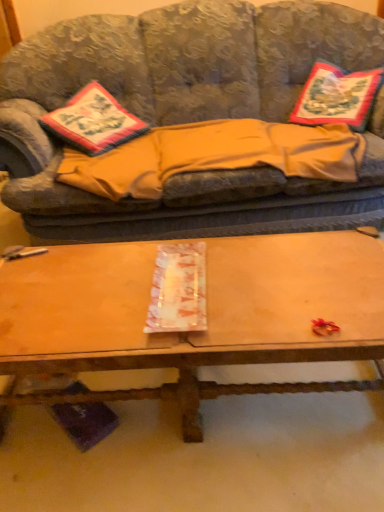
Question: Is beige fleece blanket at center completely or partially outside of embroidered fabric pillow at upper right?

Choices:
 (A) yes
 (B) no

Answer: (A)

Question: From the image's perspective, is beige fleece blanket at center on top of embroidered fabric pillow at upper right?

Choices:
 (A) yes
 (B) no

Answer: (B)

Question: Is beige fleece blanket at center shorter than embroidered fabric pillow at upper right?

Choices:
 (A) no
 (B) yes

Answer: (B)

Question: From the image's perspective, would you say beige fleece blanket at center is shown under embroidered fabric pillow at upper right?

Choices:
 (A) yes
 (B) no

Answer: (A)

Question: Is beige fleece blanket at center oriented away from embroidered fabric pillow at upper right?

Choices:
 (A) yes
 (B) no

Answer: (B)

Question: From the image's perspective, is beige fleece blanket at center positioned above or below textured fabric couch at center?

Choices:
 (A) below
 (B) above

Answer: (A)

Question: From a real-world perspective, relative to textured fabric couch at center, is beige fleece blanket at center vertically above or below?

Choices:
 (A) above
 (B) below

Answer: (B)

Question: Considering the positions of beige fleece blanket at center and textured fabric couch at center in the image, is beige fleece blanket at center taller or shorter than textured fabric couch at center?

Choices:
 (A) tall
 (B) short

Answer: (B)

Question: Based on their positions, is beige fleece blanket at center located to the left or right of textured fabric couch at center?

Choices:
 (A) right
 (B) left

Answer: (A)

Question: Is point (96, 96) closer or farther from the camera than point (223, 112)?

Choices:
 (A) closer
 (B) farther

Answer: (A)

Question: Looking at the image, does embroidered fabric pillow at left seem bigger or smaller compared to textured fabric couch at center?

Choices:
 (A) small
 (B) big

Answer: (A)

Question: Looking at their shapes, would you say embroidered fabric pillow at left is wider or thinner than textured fabric couch at center?

Choices:
 (A) thin
 (B) wide

Answer: (A)

Question: Do you think embroidered fabric pillow at left is within textured fabric couch at center, or outside of it?

Choices:
 (A) outside
 (B) inside

Answer: (B)

Question: Relative to embroidered fabric pillow at upper right, is wooden at center in front or behind?

Choices:
 (A) behind
 (B) front

Answer: (B)

Question: Considering the relative positions of wooden at center and embroidered fabric pillow at upper right in the image provided, is wooden at center to the left or to the right of embroidered fabric pillow at upper right?

Choices:
 (A) right
 (B) left

Answer: (B)